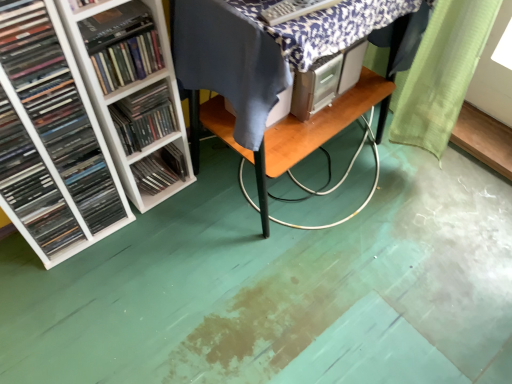
Where is `free location in front of white plastic shelf at left, the first shelf positioned from the front`? The height and width of the screenshot is (384, 512). free location in front of white plastic shelf at left, the first shelf positioned from the front is located at coordinates (159, 237).